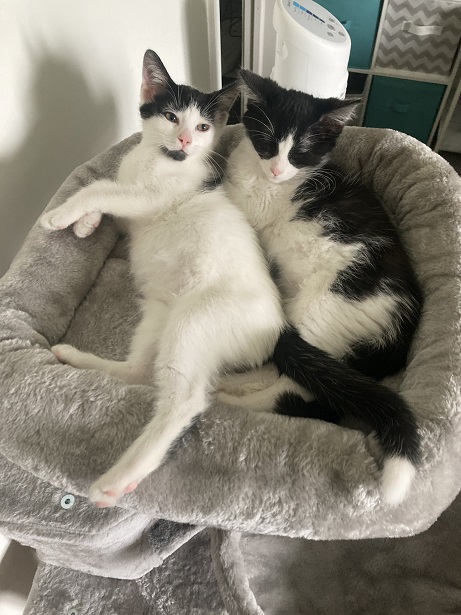
You are a GUI agent. You are given a task and a screenshot of the screen. Output one action in this format:
    pyautogui.click(x=<x>, y=<y>)
    Task: Click on the fan
    This screenshot has height=615, width=461.
    Given the screenshot: What is the action you would take?
    pyautogui.click(x=316, y=48)